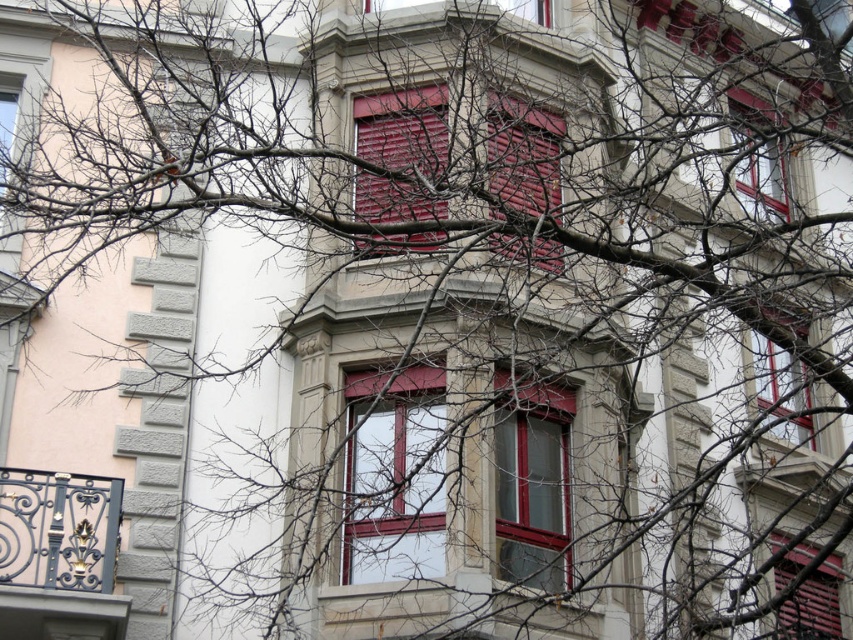
You are standing in front of the building and notice a point marked at coordinates (782,388). What object is located at that point?

The point at coordinates (782,388) is where the matte glass window at upper right is located.

In the scene shown: You are an architect analyzing the building facade. From your vantage point, which of the two windows, the matte glass window at upper right or the matte glass window at upper left, is positioned lower on the building?

The matte glass window at upper right is located below the matte glass window at upper left, so it is positioned lower on the building.